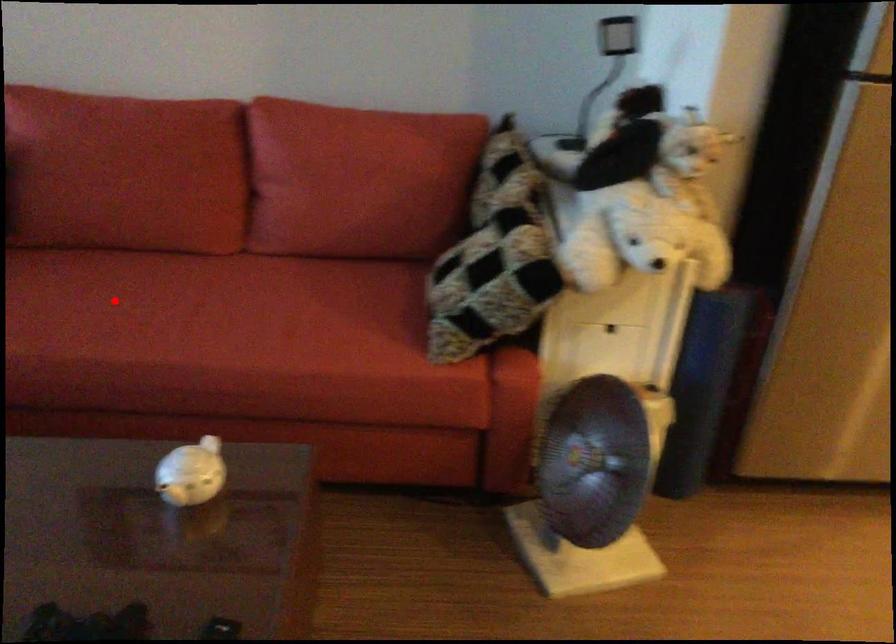
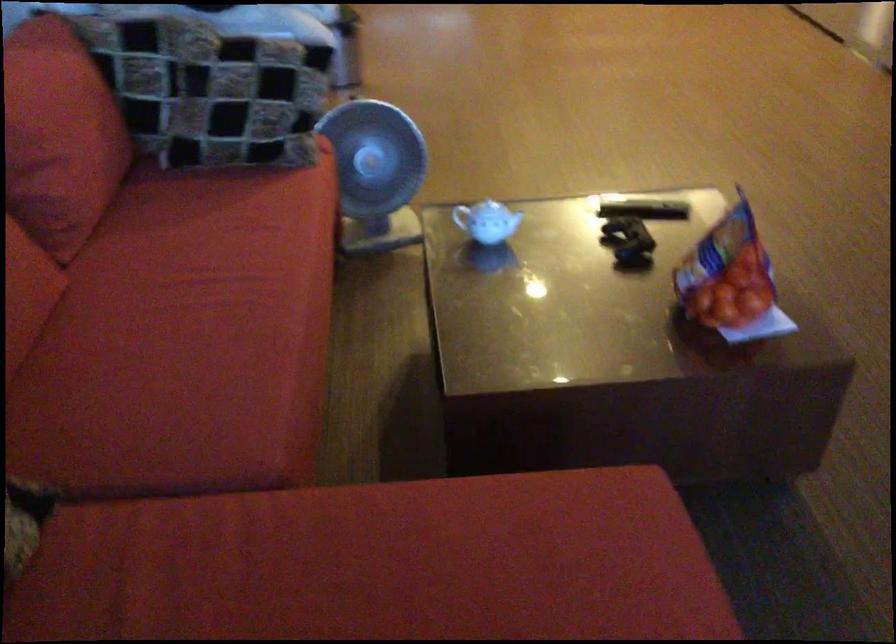
In the second image, find the point that corresponds to the highlighted location in the first image.

(192, 330)